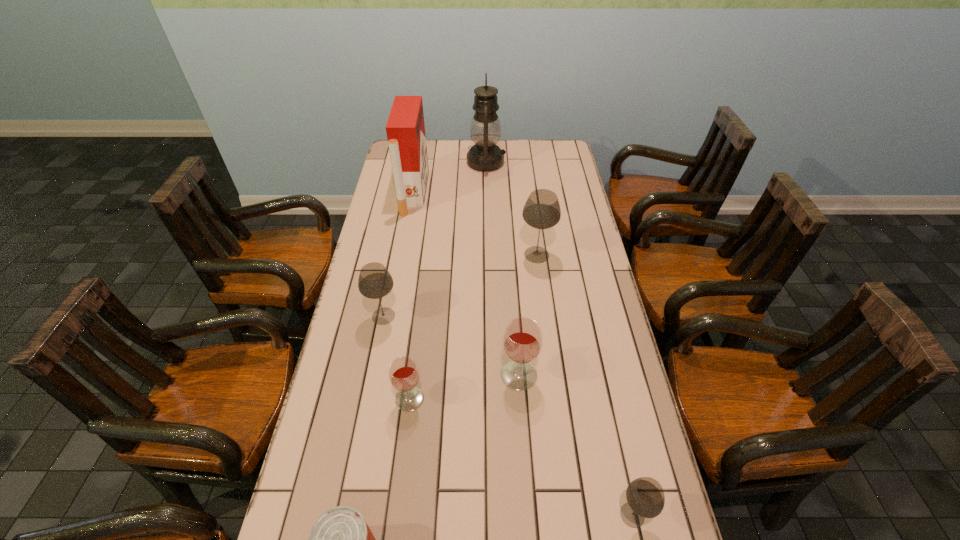
The image size is (960, 540). I want to click on free space between the fourth wineglass from right to left and the oil lamp, so click(x=448, y=280).

Where is `vacant area that lies between the oil lamp and the tallest wineglass`? This screenshot has width=960, height=540. vacant area that lies between the oil lamp and the tallest wineglass is located at coordinates (512, 208).

Where is `empty space between the smaller red wineglass and the fourth farthest object`? The width and height of the screenshot is (960, 540). empty space between the smaller red wineglass and the fourth farthest object is located at coordinates (396, 357).

Locate an element on the screen. This screenshot has height=540, width=960. object that can be found as the fifth closest to the right red wineglass is located at coordinates (340, 539).

I want to click on object identified as the second closest to the right red wineglass, so click(645, 497).

Select which wineglass is the third closest to the left red wineglass. Please provide its 2D coordinates. Your answer should be formatted as a tuple, i.e. [(x, y)], where the tuple contains the x and y coordinates of a point satisfying the conditions above.

[(645, 497)]

You are a GUI agent. You are given a task and a screenshot of the screen. Output one action in this format:
    pyautogui.click(x=<x>, y=<y>)
    Task: Click on the wineglass that stands as the fourth closest to the tallest wineglass
    The width and height of the screenshot is (960, 540).
    Given the screenshot: What is the action you would take?
    pyautogui.click(x=645, y=497)

Identify the location of gray wineglass identified as the closest to the oil lamp. (542, 210).

Select which gray wineglass is the closest to the can. Please provide its 2D coordinates. Your answer should be formatted as a tuple, i.e. [(x, y)], where the tuple contains the x and y coordinates of a point satisfying the conditions above.

[(645, 497)]

Identify the location of vacant space that satisfies the following two spatial constraints: 1. on the front-facing side of the cigarette case; 2. on the right side of the second wineglass from left to right. (376, 399).